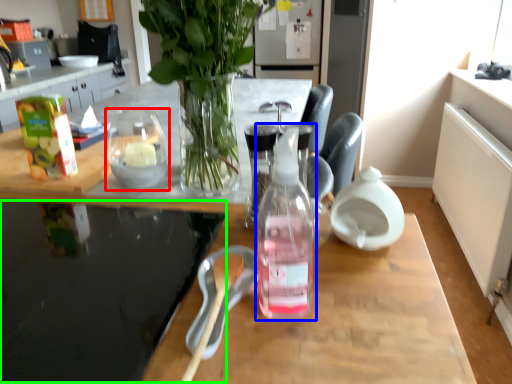
Question: Based on their relative distances, which object is farther from tableware (highlighted by a red box)? Choose from bottle (highlighted by a blue box) and glass table (highlighted by a green box).

Choices:
 (A) bottle
 (B) glass table

Answer: (A)